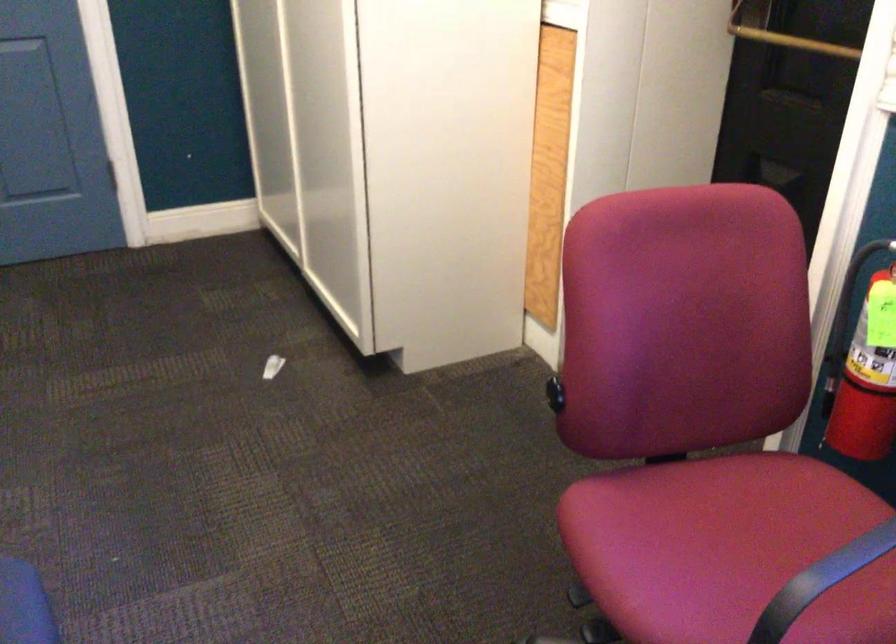
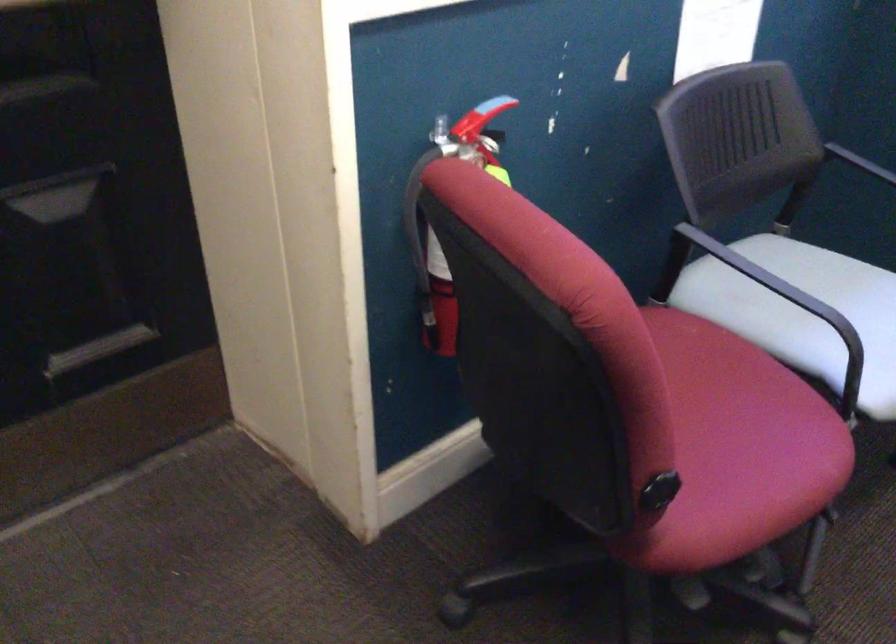
Question: I am providing you with two images of the same scene from different viewpoints. Which of the following objects are not visible in image2?

Choices:
 (A) black chair armrest
 (B) red chair sitting surface
 (C) white chair sitting surface
 (D) coffee maker buttons

Answer: (A)